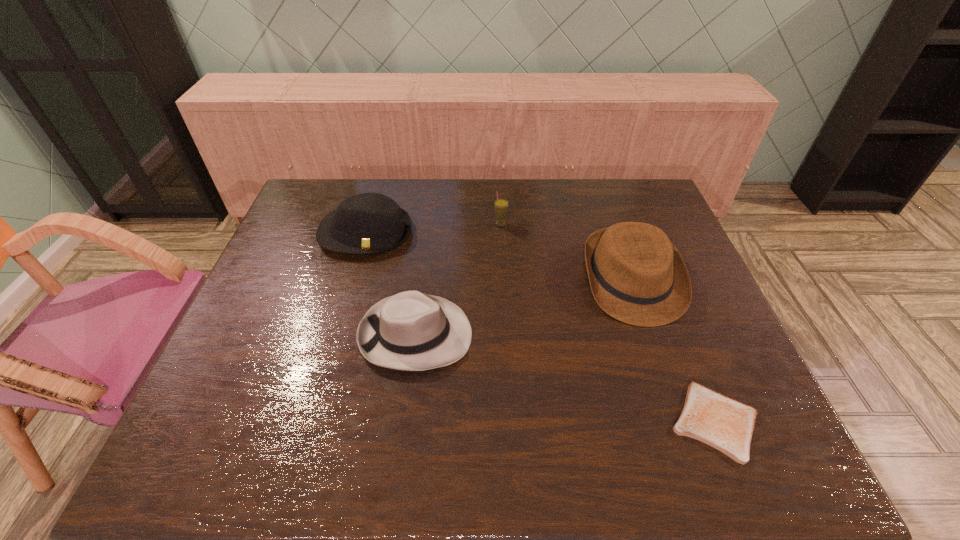
Where is `free space between the shortest object and the rightmost fedora`? Image resolution: width=960 pixels, height=540 pixels. free space between the shortest object and the rightmost fedora is located at coordinates (674, 351).

Find the location of a particular element. free space that is in between the nearest object and the rightmost fedora is located at coordinates (674, 351).

Locate an element on the screen. Image resolution: width=960 pixels, height=540 pixels. blank region between the rightmost fedora and the straw for drinking is located at coordinates (566, 253).

This screenshot has width=960, height=540. I want to click on vacant space that is in between the straw for drinking and the rightmost fedora, so click(x=566, y=253).

Identify the location of object that stands as the second closest to the nearest object. The image size is (960, 540). (411, 331).

The width and height of the screenshot is (960, 540). I want to click on the fourth closest object to the rightmost fedora, so click(368, 223).

Find the location of `fedora that is the closest one to the rightmost fedora`. fedora that is the closest one to the rightmost fedora is located at coordinates (411, 331).

Find the location of a particular element. fedora that is the third closest one to the shortest object is located at coordinates (368, 223).

Identify the location of vacant space that satisfies the following two spatial constraints: 1. on the front-facing side of the rightmost fedora; 2. on the left side of the nearest object. (681, 421).

This screenshot has width=960, height=540. I want to click on free space that satisfies the following two spatial constraints: 1. on the front-facing side of the nearest object; 2. on the left side of the rightmost fedora, so click(681, 421).